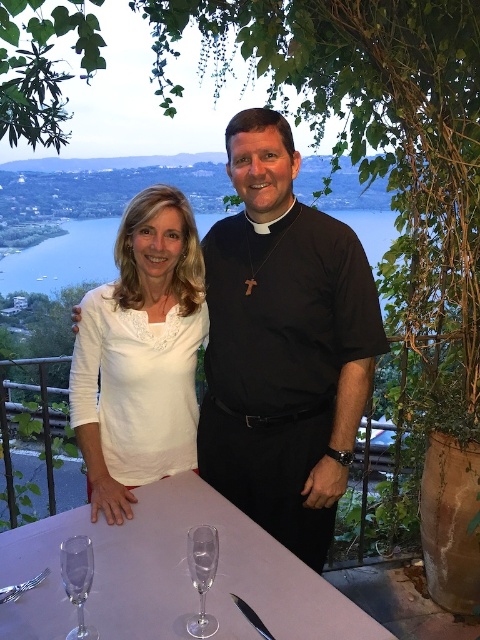
Question: Is clear glassware at center positioned before white lace shirt at center?

Choices:
 (A) no
 (B) yes

Answer: (B)

Question: Which object is positioned farthest from the clear glass wine glass at lower left?

Choices:
 (A) clear glassware at center
 (B) white lace shirt at center
 (C) black smooth shirt at center

Answer: (C)

Question: Which point is farther to the camera?

Choices:
 (A) clear glassware at center
 (B) white lace shirt at center
 (C) black smooth shirt at center
 (D) clear glass wine glass at center

Answer: (C)

Question: From the image, what is the correct spatial relationship of black smooth shirt at center in relation to white lace shirt at center?

Choices:
 (A) below
 (B) above

Answer: (A)

Question: Which point is farther to the camera?

Choices:
 (A) (168, 237)
 (B) (109, 593)
 (C) (204, 548)

Answer: (A)

Question: Can you confirm if clear glass wine glass at center is positioned below clear glass wine glass at lower left?

Choices:
 (A) yes
 (B) no

Answer: (B)